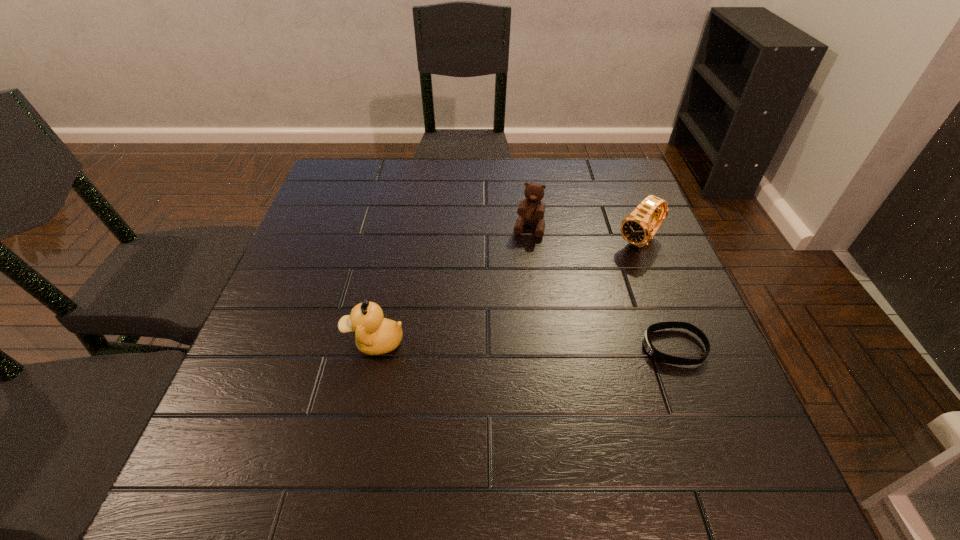
At what (x,y) coordinates should I click in order to perform the action: click on the leftmost object. Please return your answer as a coordinate pair (x, y). This screenshot has height=540, width=960. Looking at the image, I should click on (374, 335).

At what (x,y) coordinates should I click in order to perform the action: click on wristband. Please return your answer as a coordinate pair (x, y). The height and width of the screenshot is (540, 960). Looking at the image, I should click on (651, 350).

What are the coordinates of `teddy bear` in the screenshot? It's located at (531, 210).

I want to click on watch, so click(x=637, y=228).

The image size is (960, 540). I want to click on vacant space positioned 0.130m on the face of the duckling, so click(279, 342).

Image resolution: width=960 pixels, height=540 pixels. I want to click on vacant point located on the face of the duckling, so click(x=304, y=342).

The height and width of the screenshot is (540, 960). Identify the location of vacant space situated on the face of the duckling. (295, 342).

This screenshot has width=960, height=540. In order to click on vacant area situated on the display of the shortest object in this screenshot , I will do `click(482, 347)`.

Locate an element on the screen. free location located 0.110m on the display of the shortest object is located at coordinates (588, 347).

I want to click on vacant space located 0.370m on the display of the shortest object, so click(457, 347).